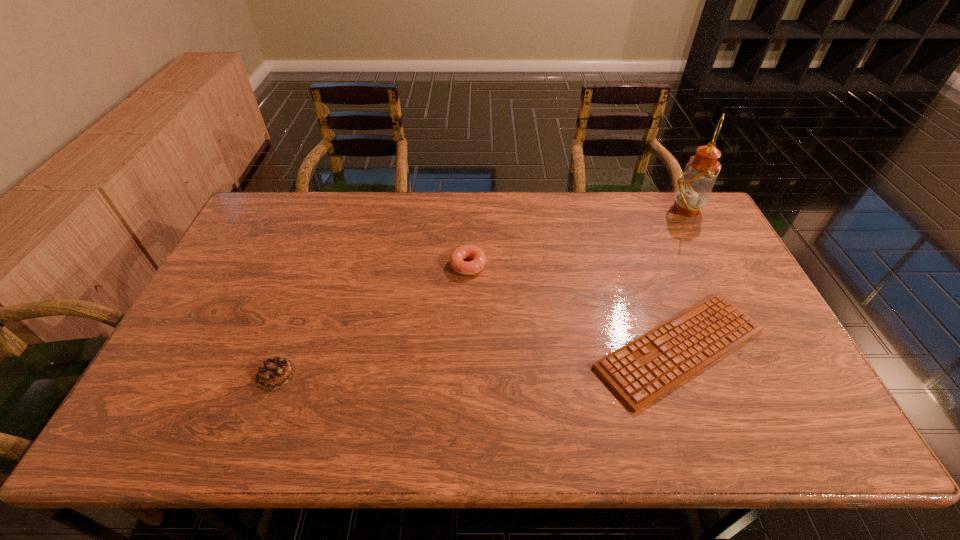
Where is `vacant region at the far right corner`? vacant region at the far right corner is located at coordinates (673, 194).

In order to click on free point at the near right corner in this screenshot , I will do `click(782, 443)`.

At what (x,y) coordinates should I click in order to perform the action: click on free space that is in between the computer keyboard and the tallest object. Please return your answer as a coordinate pair (x, y). The image size is (960, 540). Looking at the image, I should click on (683, 278).

Where is `vacant area between the farthest object and the computer keyboard`? Image resolution: width=960 pixels, height=540 pixels. vacant area between the farthest object and the computer keyboard is located at coordinates (683, 278).

Identify the location of blank region between the chocolate cake and the computer keyboard. Image resolution: width=960 pixels, height=540 pixels. (478, 361).

Image resolution: width=960 pixels, height=540 pixels. I want to click on vacant space that's between the shortest object and the leftmost object, so [x=478, y=361].

Locate an element on the screen. vacant region between the chocolate cake and the doughnut is located at coordinates click(x=372, y=320).

I want to click on vacant space in between the shortest object and the leftmost object, so click(478, 361).

The image size is (960, 540). In order to click on empty space between the chocolate cake and the third object from right to left in this screenshot , I will do `click(372, 320)`.

I want to click on vacant area between the second farthest object and the shortest object, so click(574, 307).